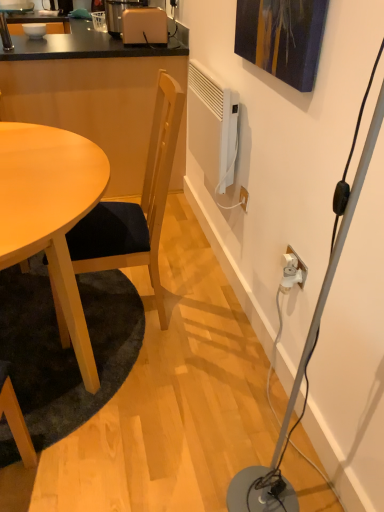
Find the location of a particular element. This screenshot has width=384, height=512. free space between wooden chair at center and light brown wooden table at lower left is located at coordinates (170, 362).